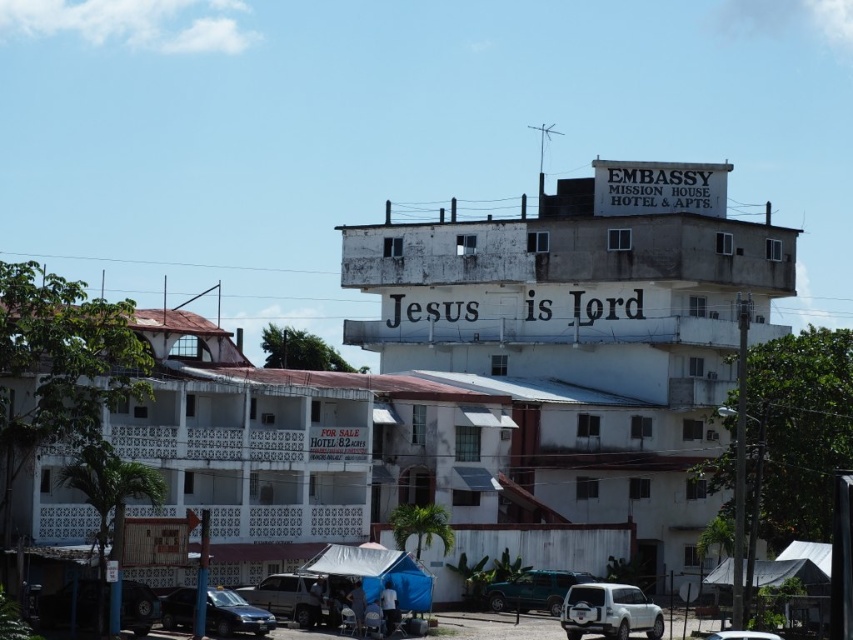
Question: Can you confirm if white matte suv at lower right is positioned above metallic blue sedan at lower left?

Choices:
 (A) yes
 (B) no

Answer: (B)

Question: Considering the real-world distances, which object is farthest from the white matte car at center?

Choices:
 (A) metallic blue sedan at lower left
 (B) teal matte car at lower center
 (C) silver metallic suv at lower center

Answer: (A)

Question: Does metallic blue sedan at lower left appear under teal matte car at lower center?

Choices:
 (A) yes
 (B) no

Answer: (B)

Question: Which point appears closest to the camera in this image?

Choices:
 (A) (91, 596)
 (B) (207, 611)
 (C) (527, 600)

Answer: (A)

Question: Is metallic blue sedan at lower left to the right of white matte car at center from the viewer's perspective?

Choices:
 (A) no
 (B) yes

Answer: (A)

Question: Which object is farther from the camera taking this photo?

Choices:
 (A) teal matte car at lower center
 (B) silver metallic suv at lower center
 (C) white matte suv at lower right
 (D) metallic blue sedan at lower left

Answer: (A)